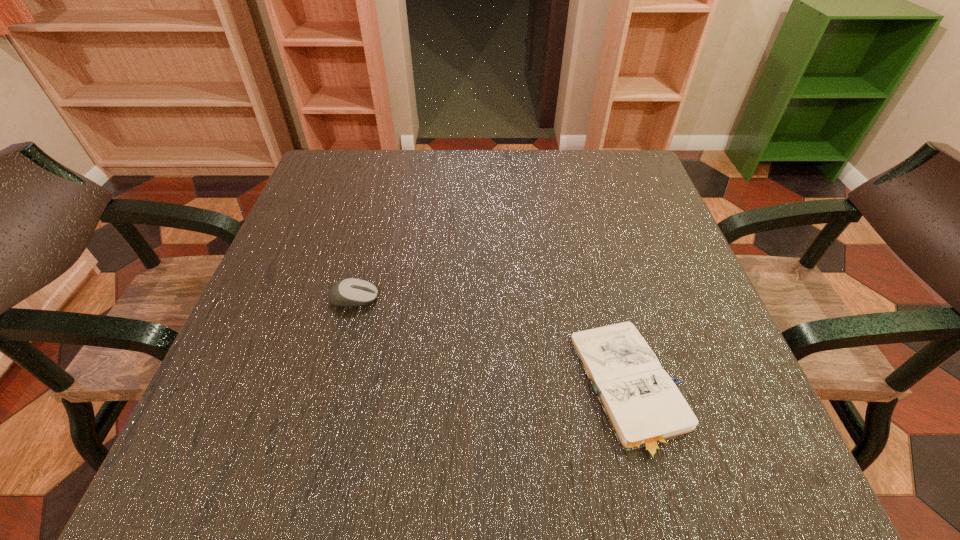
Where is `the farther object`? the farther object is located at coordinates tap(348, 292).

Locate an element on the screen. This screenshot has width=960, height=540. the taller object is located at coordinates (348, 292).

Image resolution: width=960 pixels, height=540 pixels. Find the location of `notebook`. notebook is located at coordinates (646, 411).

This screenshot has width=960, height=540. I want to click on the nearer object, so click(x=646, y=411).

The image size is (960, 540). Find the location of `vacant space situated 0.240m on the wheel side of the left object`. vacant space situated 0.240m on the wheel side of the left object is located at coordinates [x=507, y=298].

This screenshot has width=960, height=540. Find the location of `free space located on the right of the notebook`. free space located on the right of the notebook is located at coordinates (730, 389).

This screenshot has width=960, height=540. I want to click on object located at the near edge, so click(x=646, y=411).

The image size is (960, 540). Identify the location of object that is at the left edge. (348, 292).

Locate an element on the screen. The width and height of the screenshot is (960, 540). object present at the right edge is located at coordinates (646, 411).

Locate an element on the screen. object at the near right corner is located at coordinates (646, 411).